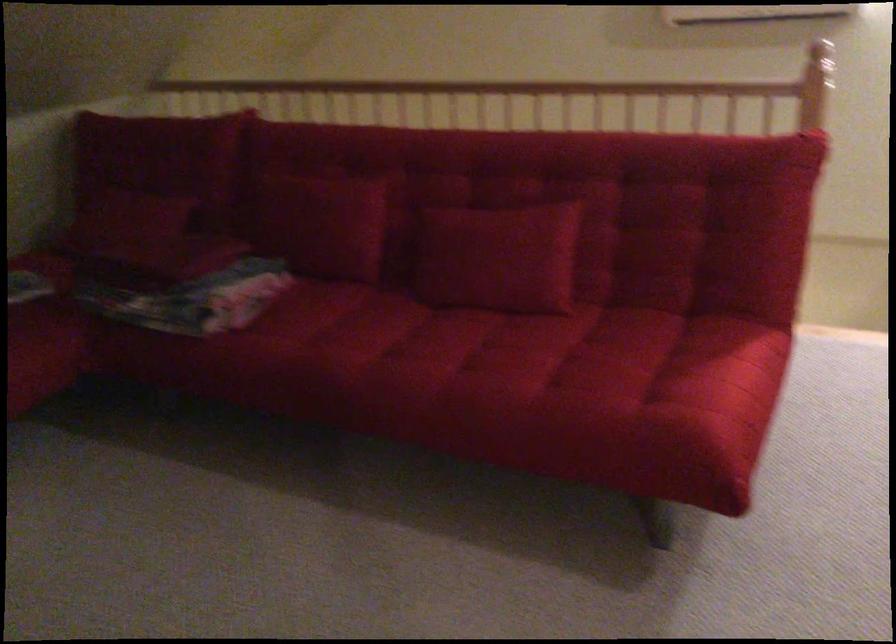
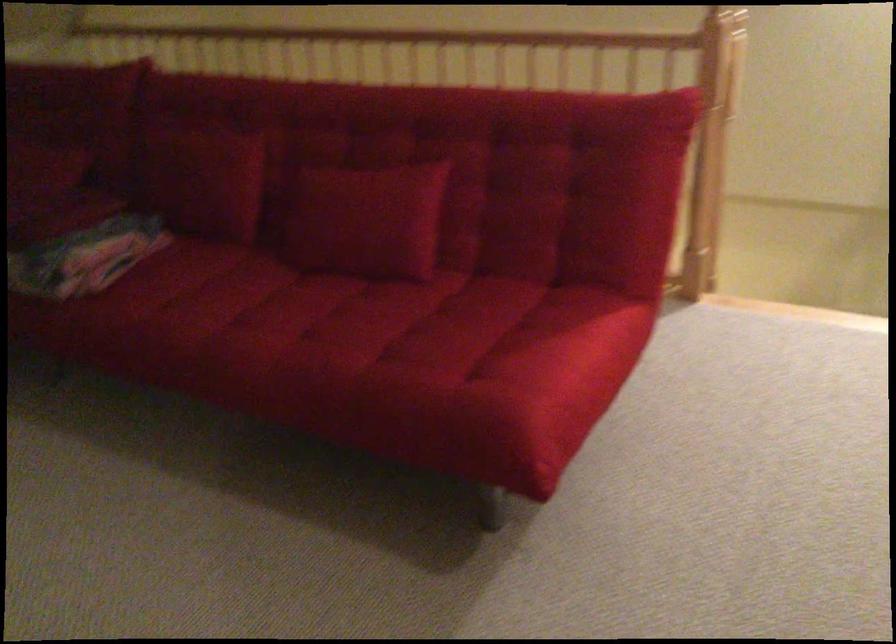
Question: The images are taken continuously from a first-person perspective. In which direction is your viewpoint rotating?

Choices:
 (A) Left
 (B) Right
 (C) Up
 (D) Down

Answer: (D)